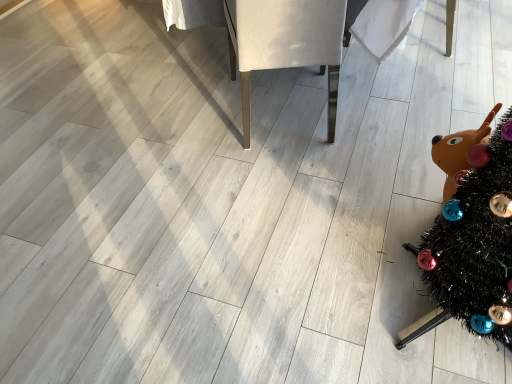
Locate an element on the screen. The width and height of the screenshot is (512, 384). free area below black tinsel christmas tree at lower right (from a real-world perspective) is located at coordinates (440, 316).